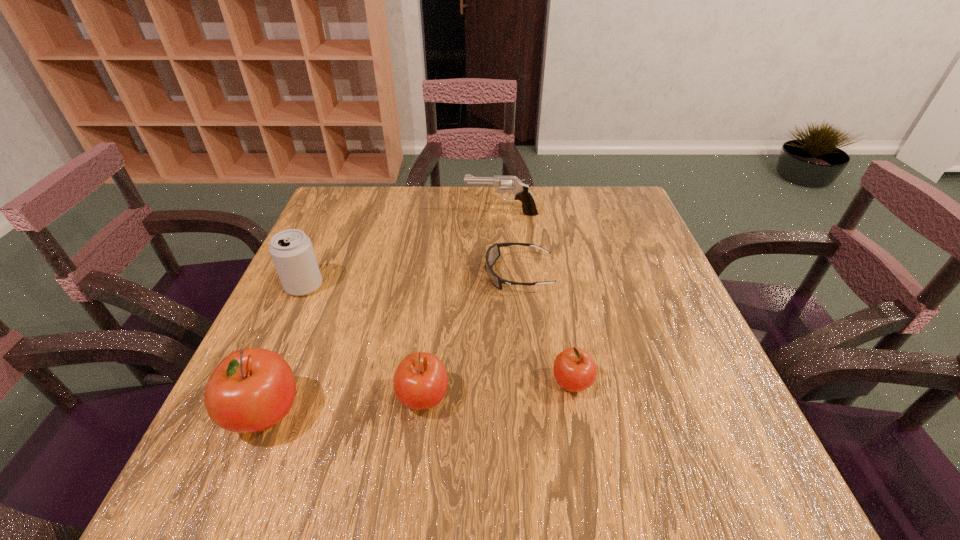
Locate an element on the screen. free space between the can and the second shortest object is located at coordinates (438, 335).

Find the location of a particular element. This screenshot has width=960, height=540. vacant space that's between the can and the farthest object is located at coordinates (402, 249).

Where is `free space between the farthest object and the shortest apple`? This screenshot has height=540, width=960. free space between the farthest object and the shortest apple is located at coordinates (537, 298).

I want to click on empty location between the fifth tallest object and the shortest object, so click(545, 329).

You are a GUI agent. You are given a task and a screenshot of the screen. Output one action in this format:
    pyautogui.click(x=<x>, y=<y>)
    Task: Click on the vacant area that lies between the shortest object and the can
    The height and width of the screenshot is (540, 960).
    Given the screenshot: What is the action you would take?
    pyautogui.click(x=412, y=280)

I want to click on free area in between the fourth object from right to left and the gun, so click(x=462, y=306).

Where is `blank region between the can and the second apple from right to left`? blank region between the can and the second apple from right to left is located at coordinates (364, 342).

Where is `vacant space that is in between the fifth tallest object and the can`? vacant space that is in between the fifth tallest object and the can is located at coordinates (438, 335).

Identify the location of object that can be found as the closest to the second shortest apple. This screenshot has width=960, height=540. (x=252, y=389).

Locate which object ranks third in proximity to the shortest object. Please provide its 2D coordinates. Your answer should be formatted as a tuple, i.e. [(x, y)], where the tuple contains the x and y coordinates of a point satisfying the conditions above.

[(420, 382)]